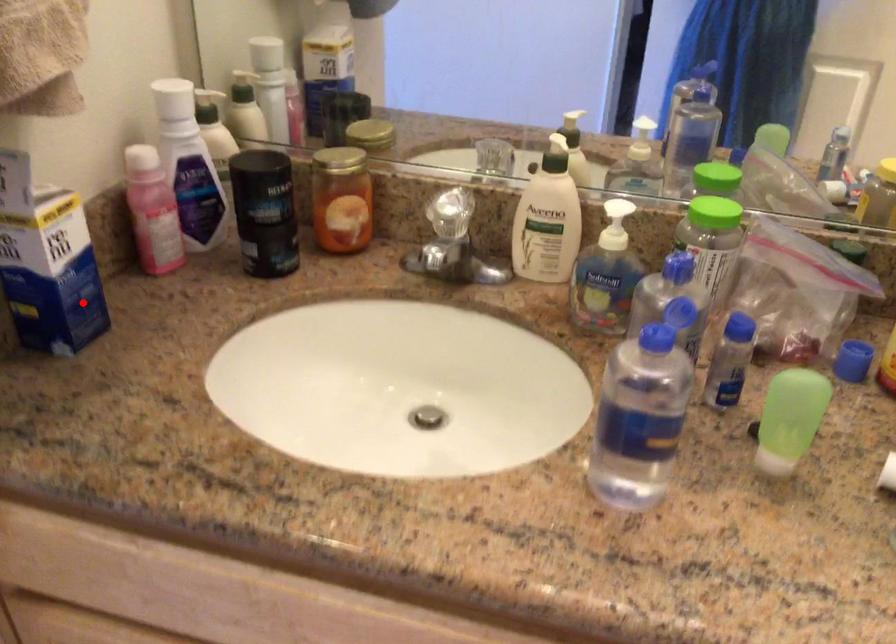
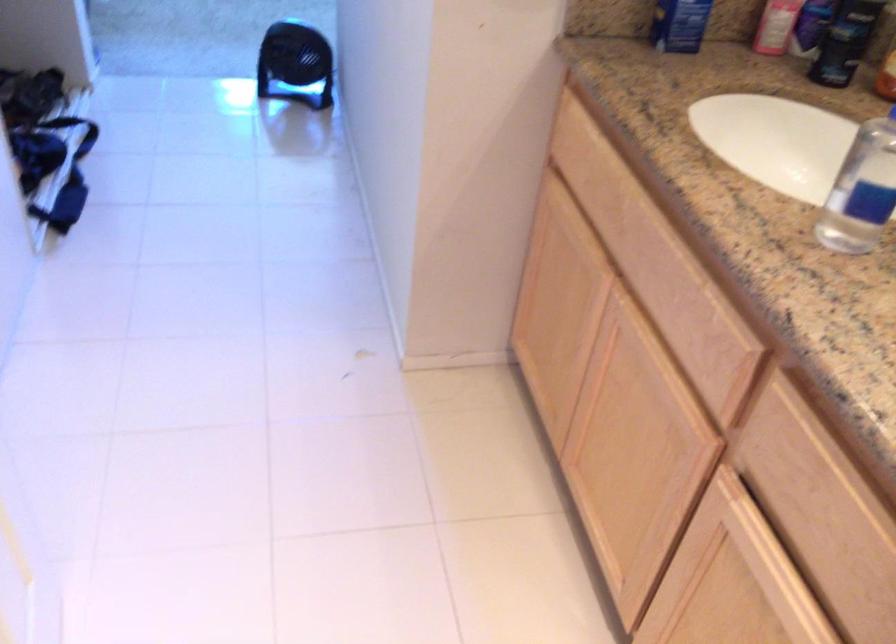
The point at the highlighted location is marked in the first image. Where is the corresponding point in the second image?

(679, 24)